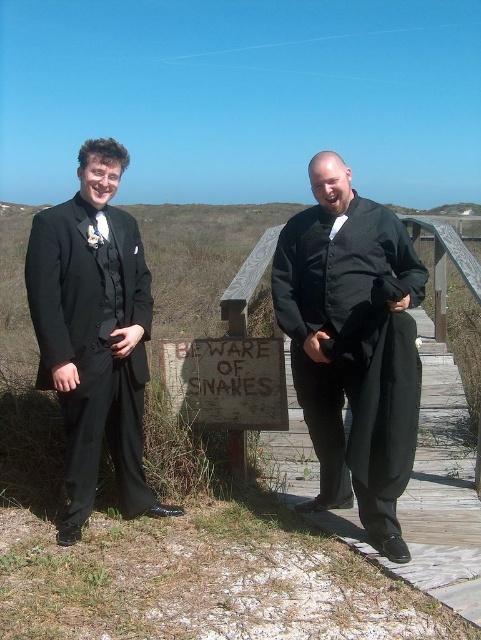
Between matte black suit at left and weathered wooden sign at center, which one has more height?

weathered wooden sign at center

Which is behind, point (101, 305) or point (189, 413)?

Positioned behind is point (189, 413).

The height and width of the screenshot is (640, 481). What do you see at coordinates (93, 332) in the screenshot?
I see `matte black suit at left` at bounding box center [93, 332].

You are a GUI agent. You are given a task and a screenshot of the screen. Output one action in this format:
    pyautogui.click(x=<x>, y=<y>)
    Task: Click on the matte black suit at left
    
    Given the screenshot: What is the action you would take?
    pyautogui.click(x=93, y=332)

Is black satin suit at center bigger than weathered wooden sign at center?

Indeed, black satin suit at center has a larger size compared to weathered wooden sign at center.

Does black satin suit at center have a lesser height compared to weathered wooden sign at center?

Incorrect, black satin suit at center's height does not fall short of weathered wooden sign at center's.

Which is in front, point (389, 449) or point (265, 410)?

Positioned in front is point (389, 449).

In order to click on black satin suit at center in this screenshot , I will do `click(353, 344)`.

The image size is (481, 640). What do you see at coordinates (353, 344) in the screenshot?
I see `black satin suit at center` at bounding box center [353, 344].

Does black satin suit at center have a smaller size compared to matte black suit at left?

Incorrect, black satin suit at center is not smaller in size than matte black suit at left.

Does point (334, 349) come behind point (111, 305)?

No.

This screenshot has width=481, height=640. Identify the location of black satin suit at center. (353, 344).